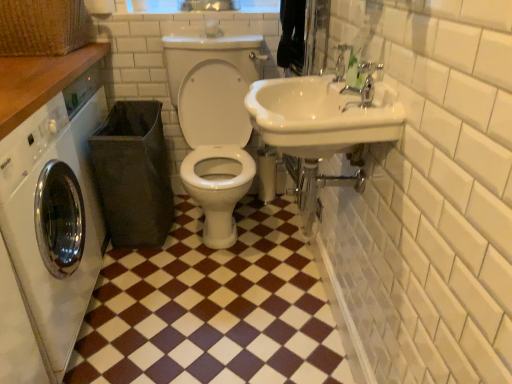
Identify the location of vacant space underneath white glossy toilet at center (from a real-world perspective). (236, 234).